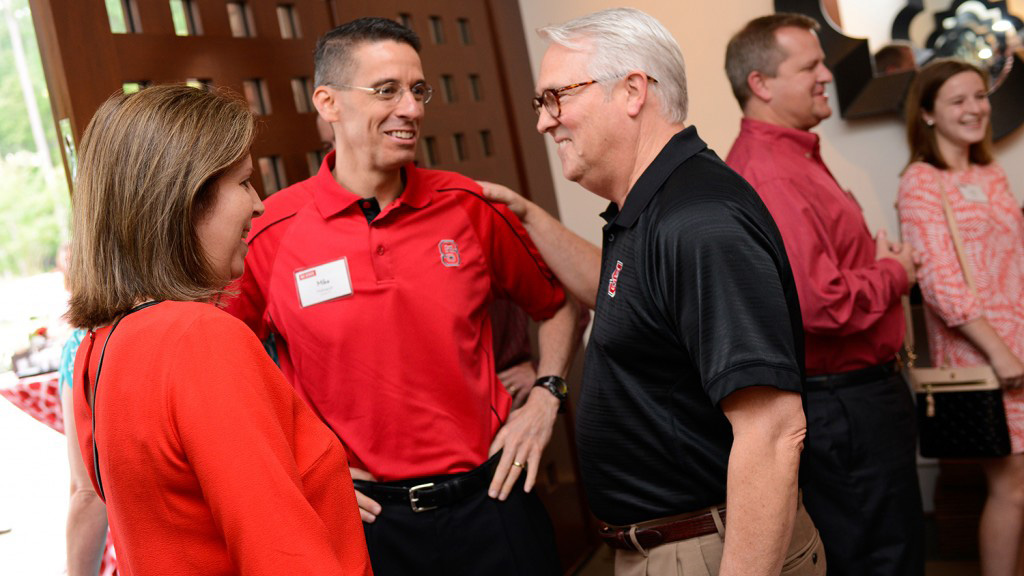
Locate an element on the screen. The image size is (1024, 576). mirror is located at coordinates (958, 26).